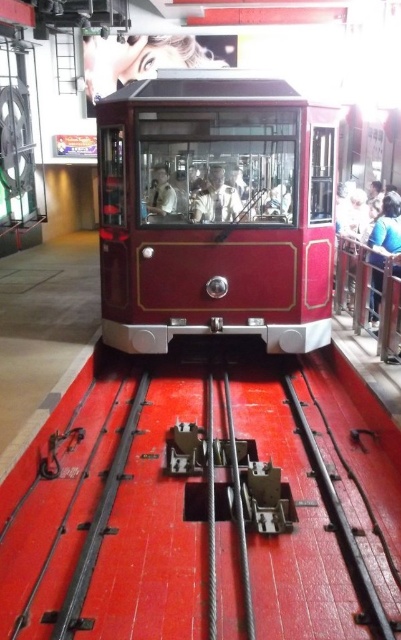
You are a visitor standing at the entrance of the museum. You see the metallic red train track at center and the shiny red tram at center. Which object is closer to you?

The metallic red train track at center is closer to you because it is in front of the shiny red tram at center.

You are standing in a museum and see the metallic red train track at center and the shiny red tram at center. Which object is positioned to the left of the other?

The metallic red train track at center is to the left of the shiny red tram at center.

You are a visitor at the museum and want to take a photo of the shiny red tram at center. To avoid blocking the tram with your foot, where should you stand relative to the metallic red train track at center?

You should stand behind the metallic red train track at center because the metallic red train track at center is below the shiny red tram at center, meaning the tram is elevated above the tracks. Positioning yourself behind the tracks ensures your foot won not block the view of the tram.